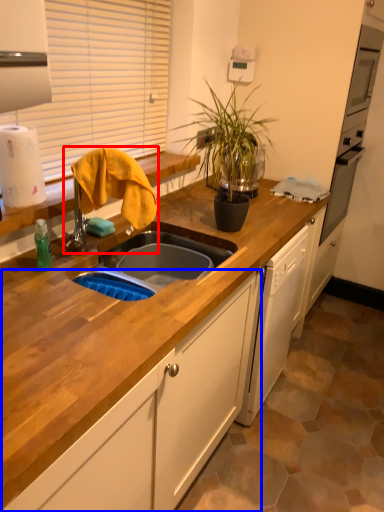
Question: Which object is further to the camera taking this photo, faucet (highlighted by a red box) or cabinetry (highlighted by a blue box)?

Choices:
 (A) faucet
 (B) cabinetry

Answer: (A)